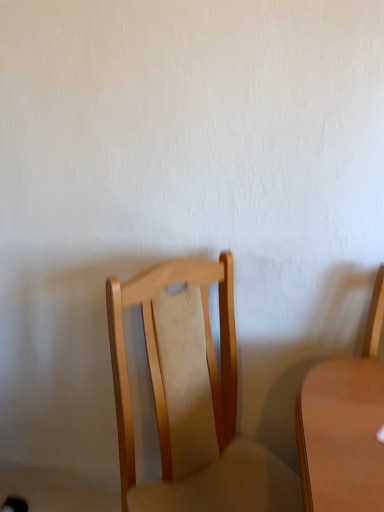
Question: From a real-world perspective, is light brown wood chair at right, acting as the 1th chair starting from the right, physically located above or below light wood chair at center, placed as the second chair when sorted from right to left?

Choices:
 (A) below
 (B) above

Answer: (B)

Question: Considering their positions, is light brown wood chair at right, acting as the 1th chair starting from the right, located in front of or behind light wood chair at center, placed as the second chair when sorted from right to left?

Choices:
 (A) front
 (B) behind

Answer: (B)

Question: Looking at the image, does light brown wood chair at right, acting as the 1th chair starting from the right, seem bigger or smaller compared to light wood chair at center, the 1th chair when ordered from left to right?

Choices:
 (A) small
 (B) big

Answer: (A)

Question: From the image's perspective, relative to light brown wood chair at right, placed as the second chair when sorted from left to right, is light wood chair at center, the 1th chair when ordered from left to right, above or below?

Choices:
 (A) below
 (B) above

Answer: (A)

Question: Is light wood chair at center, the 1th chair when ordered from left to right, wider or thinner than light brown wood chair at right, acting as the 1th chair starting from the right?

Choices:
 (A) wide
 (B) thin

Answer: (A)

Question: Considering the positions of light wood chair at center, the 1th chair when ordered from left to right, and light brown wood chair at right, placed as the second chair when sorted from left to right, in the image, is light wood chair at center, the 1th chair when ordered from left to right, taller or shorter than light brown wood chair at right, placed as the second chair when sorted from left to right,?

Choices:
 (A) short
 (B) tall

Answer: (B)

Question: From a real-world perspective, is light wood chair at center, the 1th chair when ordered from left to right, physically located above or below light brown wood chair at right, acting as the 1th chair starting from the right?

Choices:
 (A) below
 (B) above

Answer: (A)